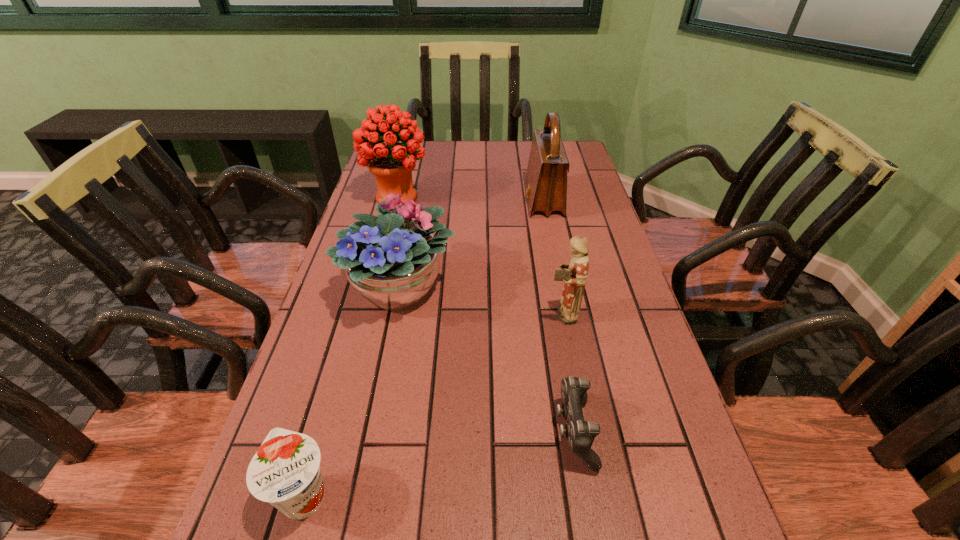
Find the location of `figurine at the right edge`. figurine at the right edge is located at coordinates (574, 275).

Where is `vacant area at the far edge of the desktop`? The width and height of the screenshot is (960, 540). vacant area at the far edge of the desktop is located at coordinates (444, 164).

Where is `free space at the left edge`? This screenshot has height=540, width=960. free space at the left edge is located at coordinates (344, 435).

This screenshot has height=540, width=960. Identify the location of vacant space at the right edge. (620, 489).

Identify the location of vacant space at the far left corner of the desktop. (400, 141).

Locate an element on the screen. blank region between the control and the taller bouquet is located at coordinates (486, 314).

Find the location of `vacant space in between the farther bouquet and the figurine`. vacant space in between the farther bouquet and the figurine is located at coordinates (479, 255).

The width and height of the screenshot is (960, 540). What are the coordinates of `vacant area that lies between the figurine and the taller bouquet` in the screenshot? It's located at (479, 255).

Where is `free area in between the shoulder bag and the yogurt`? The width and height of the screenshot is (960, 540). free area in between the shoulder bag and the yogurt is located at coordinates (423, 348).

Where is `vacant area that lies between the farther bouquet and the control`? The height and width of the screenshot is (540, 960). vacant area that lies between the farther bouquet and the control is located at coordinates (486, 314).